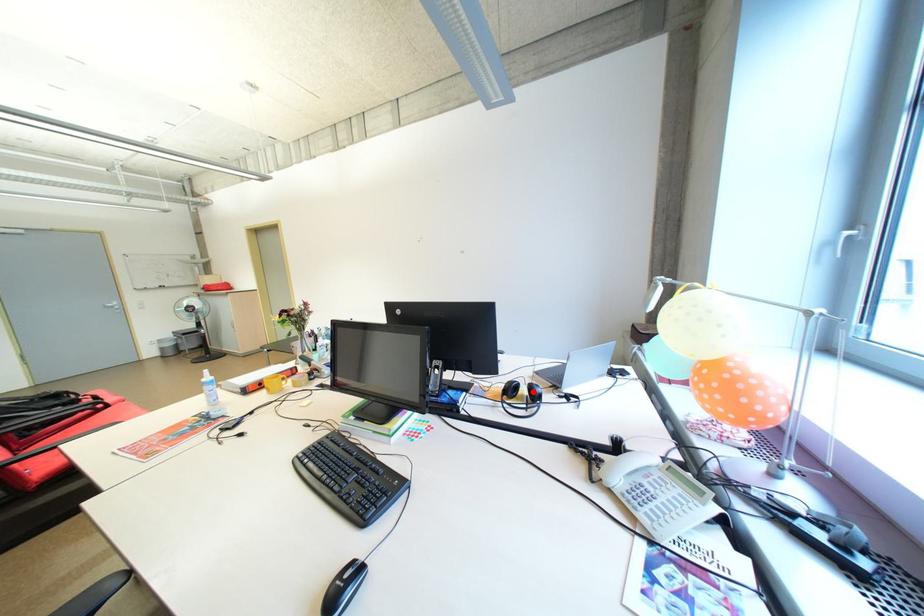
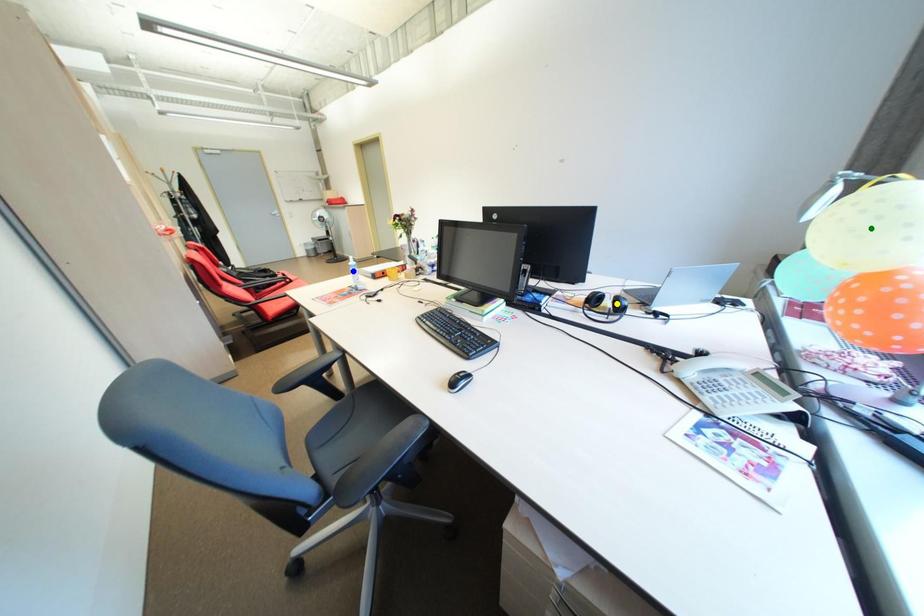
Question: I am providing you with two images of the same scene from different viewpoints. A red point is marked on the first image. You are given multiple points on the second image. Which point in image 2 represents the same 3d spot as the red point in image 1?

Choices:
 (A) blue point
 (B) green point
 (C) yellow point

Answer: (C)